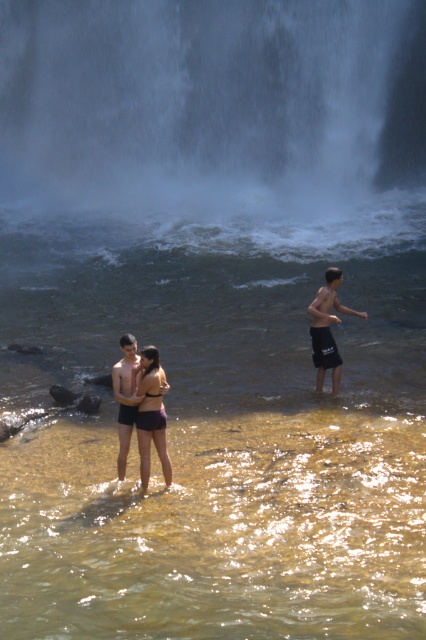
Looking at this image, you are a photographer trying to capture the waterfall scene. You want to ensure that the dark gray shorts at right are visible in the reflection of the murky brownish yellow water. Based on the scene description, is the water reflective enough to show this detail?

The murky brownish yellow water in the scene is described as reflecting sunlight and creating a shimmering effect, which suggests it has some reflective properties. However, the dark gray shorts at right are located at point (328, 328). Whether the reflection would clearly show the shorts depends on the angle and distance from the water surface. Since the water is murky, the reflection might be distorted or unclear, making it difficult to see specific details like the shorts.